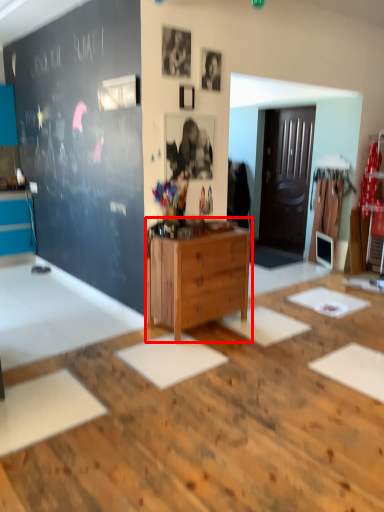
Question: Considering the relative positions of chest of drawers (annotated by the red box) and table in the image provided, where is chest of drawers (annotated by the red box) located with respect to the staircase?

Choices:
 (A) left
 (B) right

Answer: (B)